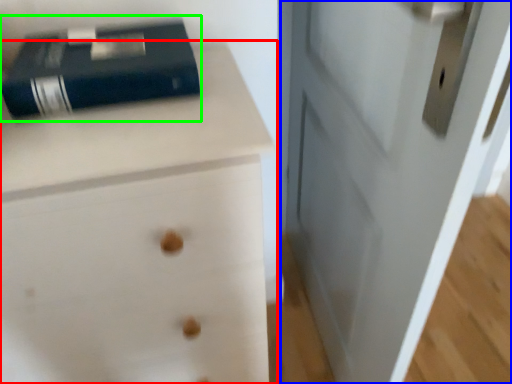
Question: Which object is the closest to the chest of drawers (highlighted by a red box)? Choose among these: door (highlighted by a blue box) or paperback book (highlighted by a green box).

Choices:
 (A) door
 (B) paperback book

Answer: (B)